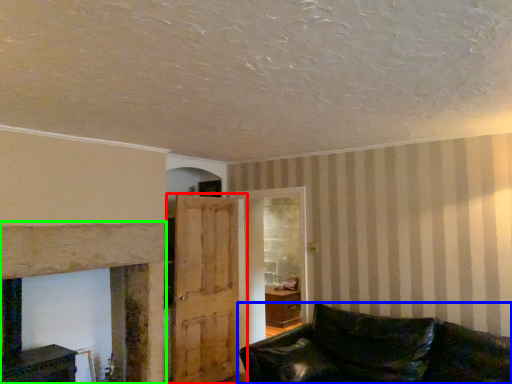
Question: Considering the real-world distances, which object is closest to door (highlighted by a red box)? studio couch (highlighted by a blue box) or fireplace (highlighted by a green box).

Choices:
 (A) studio couch
 (B) fireplace

Answer: (B)